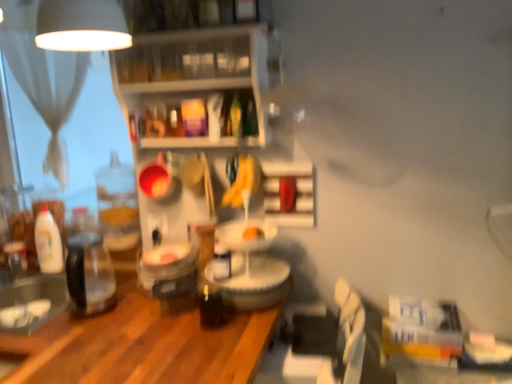
Question: Considering the relative sizes of white sheer curtain at upper left and yellow matte bananas at center in the image provided, is white sheer curtain at upper left taller than yellow matte bananas at center?

Choices:
 (A) no
 (B) yes

Answer: (B)

Question: From a real-world perspective, does white sheer curtain at upper left sit lower than yellow matte bananas at center?

Choices:
 (A) yes
 (B) no

Answer: (B)

Question: Does white sheer curtain at upper left have a lesser height compared to yellow matte bananas at center?

Choices:
 (A) no
 (B) yes

Answer: (A)

Question: Does white sheer curtain at upper left touch yellow matte bananas at center?

Choices:
 (A) yes
 (B) no

Answer: (B)

Question: Is white sheer curtain at upper left not near yellow matte bananas at center?

Choices:
 (A) yes
 (B) no

Answer: (B)

Question: Does white sheer curtain at upper left have a lesser width compared to yellow matte bananas at center?

Choices:
 (A) no
 (B) yes

Answer: (A)

Question: From a real-world perspective, does white glossy bottle at left stand above yellow matte bananas at center?

Choices:
 (A) yes
 (B) no

Answer: (B)

Question: Is white glossy bottle at left behind yellow matte bananas at center?

Choices:
 (A) no
 (B) yes

Answer: (B)

Question: Does white glossy bottle at left have a lesser width compared to yellow matte bananas at center?

Choices:
 (A) yes
 (B) no

Answer: (B)

Question: From the image's perspective, is white glossy bottle at left beneath yellow matte bananas at center?

Choices:
 (A) no
 (B) yes

Answer: (B)

Question: Is white glossy bottle at left at the right side of yellow matte bananas at center?

Choices:
 (A) no
 (B) yes

Answer: (A)

Question: Is yellow matte bananas at center at the back of white glossy bottle at left?

Choices:
 (A) yes
 (B) no

Answer: (B)

Question: From a real-world perspective, is yellow matte bananas at center physically below clear plastic shelves at upper center, the first shelf in the left-to-right sequence?

Choices:
 (A) yes
 (B) no

Answer: (A)